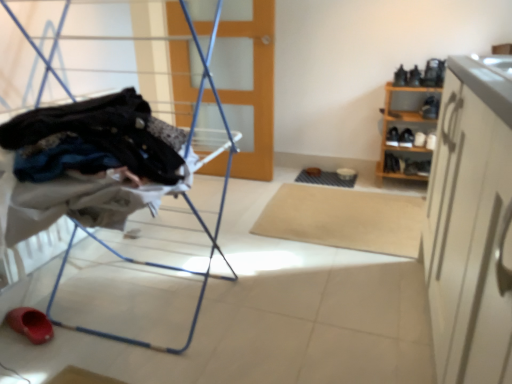
The width and height of the screenshot is (512, 384). I want to click on spots to the right of metal laundry rack at left, so click(x=303, y=299).